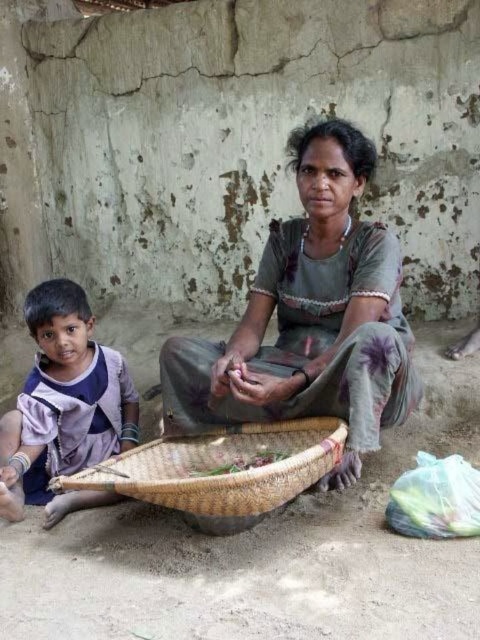
You are standing in the room and want to reach a point that is 7.91 feet away from you. Can you confirm if the point at coordinates (47, 310) is exactly at that distance?

Yes, the point at coordinates (47, 310) is exactly 7.91 feet away from the viewer.

You are a tailor measuring the distance between the gray fabric dress at center and the woven brown basket at lower center. The minimum distance required to work comfortably is 12 inches. Based on the scene, can you comfortably work between them?

The gray fabric dress at center is 11.92 inches from the woven brown basket at lower center. Since the required distance is 12 inches, the tailor cannot work comfortably between them as the space is slightly less than needed.

You are organizing a clothing donation drive and need to arrange the gray fabric dress at center and the light purple fabric at lower left on a rack. Based on their positions in the image, which fabric should you place on the right side of the rack?

The gray fabric dress at center should be placed on the right side of the rack because it is positioned on the right side of the light purple fabric at lower left in the image.